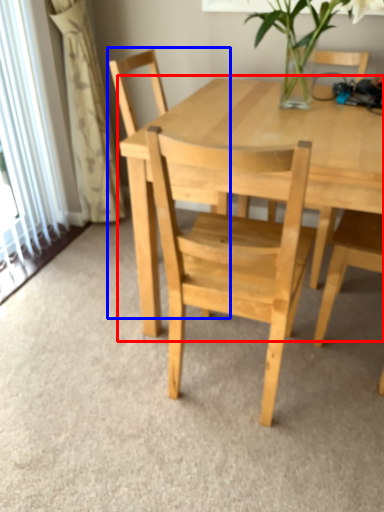
Question: Which of the following is the farthest to the observer, round table (highlighted by a red box) or chair (highlighted by a blue box)?

Choices:
 (A) round table
 (B) chair

Answer: (B)